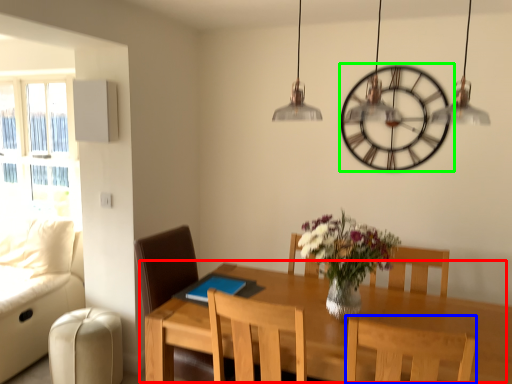
Question: Which object is the farthest from table (highlighted by a red box)? Choose among these: chair (highlighted by a blue box) or wall clock (highlighted by a green box).

Choices:
 (A) chair
 (B) wall clock

Answer: (B)